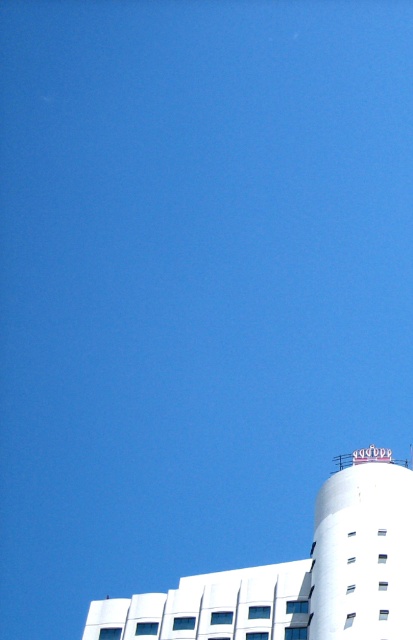
You are a drone operator needing to fly a drone from the white smooth building at lower right to the white smooth water tower at bottom right. Considering their heights, which one is higher?

The white smooth building at lower right is much taller than the white smooth water tower at bottom right, so the building is higher.

You are standing at the entrance of the white smooth building at lower right and want to see the white smooth water tower at bottom right. Which direction should you face to look upwards to see it?

The white smooth water tower at bottom right is positioned above the white smooth building at lower right, so you should face towards the top of the building to look upwards and see the water tower.

You are standing at the center of the image. Which direction should you move to reach the white smooth building at lower right?

Since the white smooth building at lower right is located at point (299, 573), you should move towards the lower right direction to reach it.